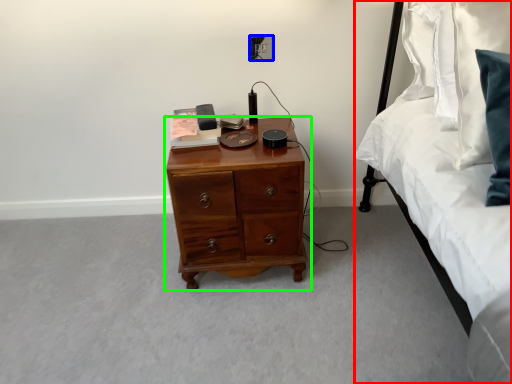
Question: Considering the real-world distances, which object is farthest from bed (highlighted by a red box)? electric outlet (highlighted by a blue box) or chest of drawers (highlighted by a green box)?

Choices:
 (A) electric outlet
 (B) chest of drawers

Answer: (A)